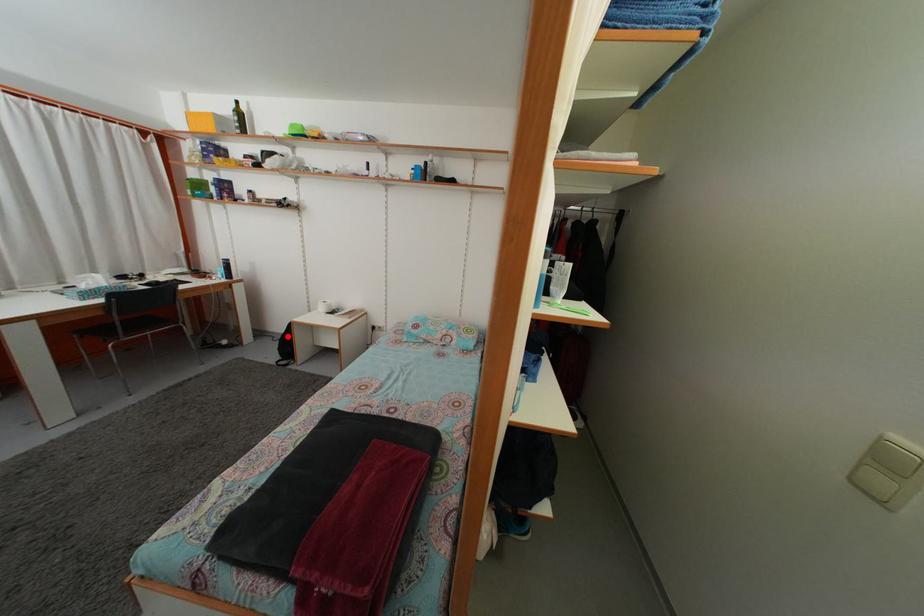
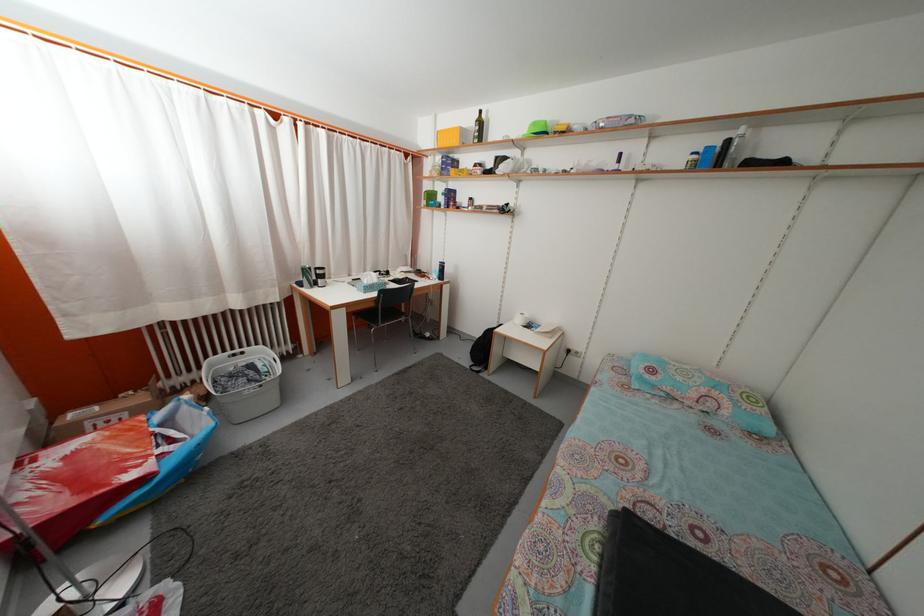
Question: I am providing you with two images of the same scene from different viewpoints. A red point is shown in image1. For the corresponding object point in image2, is it positioned nearer or farther from the camera?

Choices:
 (A) Nearer
 (B) Farther

Answer: (A)